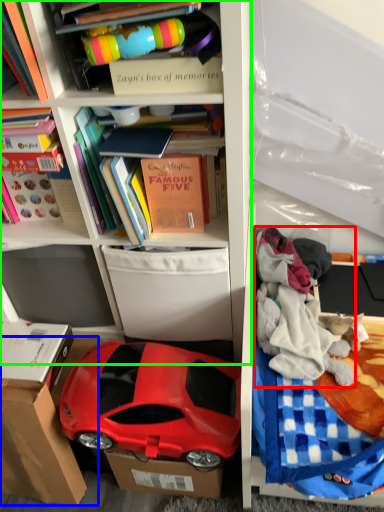
Question: Estimate the real-world distances between objects in this image. Which object is closer to clothing (highlighted by a red box), cardboard box (highlighted by a blue box) or shelf (highlighted by a green box)?

Choices:
 (A) cardboard box
 (B) shelf

Answer: (B)